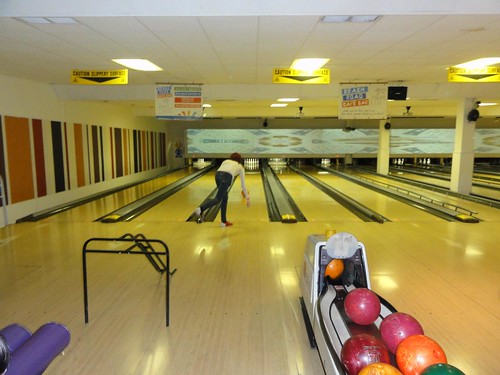
You are a GUI agent. You are given a task and a screenshot of the screen. Output one action in this format:
    pyautogui.click(x=<x>, y=<y>)
    Task: Click on the ceiling flourescent
    
    Given the screenshot: What is the action you would take?
    pyautogui.click(x=488, y=66), pyautogui.click(x=315, y=66), pyautogui.click(x=142, y=65), pyautogui.click(x=121, y=68), pyautogui.click(x=305, y=68), pyautogui.click(x=475, y=70)